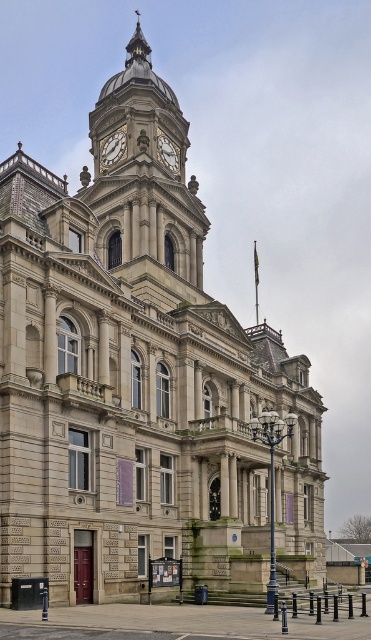
Between golden stone clock tower at upper center and matte gray clock at upper center, which one appears on the right side from the viewer's perspective?

Positioned to the right is matte gray clock at upper center.

Can you confirm if golden stone clock tower at upper center is thinner than matte gray clock at upper center?

No.

Consider the image. Measure the distance between point [110,168] and camera.

Point [110,168] and camera are 101.11 meters apart from each other.

I want to click on golden stone clock tower at upper center, so click(143, 172).

Is golden stone clock tower at upper center bigger than white marble clock at upper center?

Indeed, golden stone clock tower at upper center has a larger size compared to white marble clock at upper center.

Which of these two, golden stone clock tower at upper center or white marble clock at upper center, stands shorter?

Standing shorter between the two is white marble clock at upper center.

Locate an element on the screen. golden stone clock tower at upper center is located at coordinates (143, 172).

Can you confirm if matte gray clock at upper center is taller than white marble clock at upper center?

Indeed, matte gray clock at upper center has a greater height compared to white marble clock at upper center.

Find the location of a particular element. matte gray clock at upper center is located at coordinates (113, 147).

Where is `matte gray clock at upper center`? The image size is (371, 640). matte gray clock at upper center is located at coordinates (113, 147).